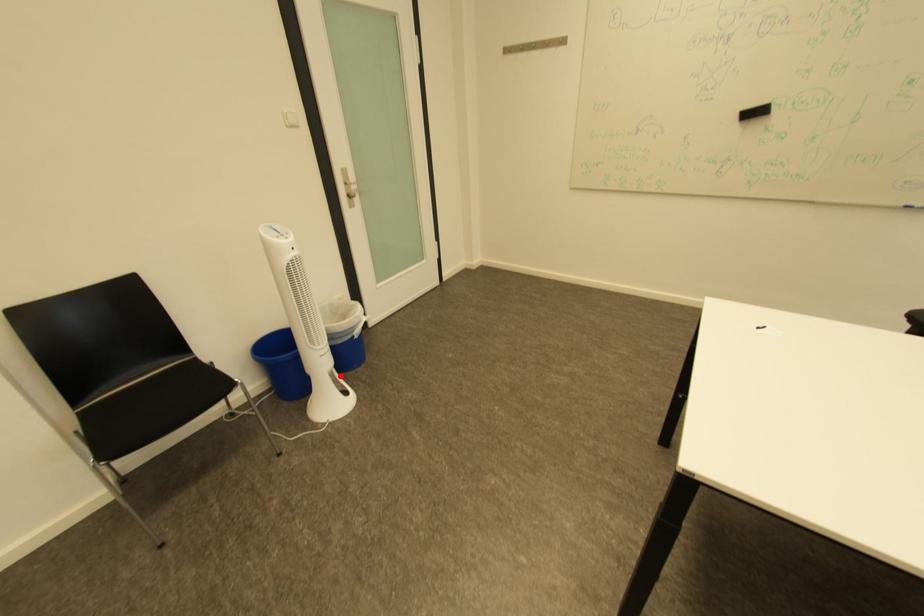
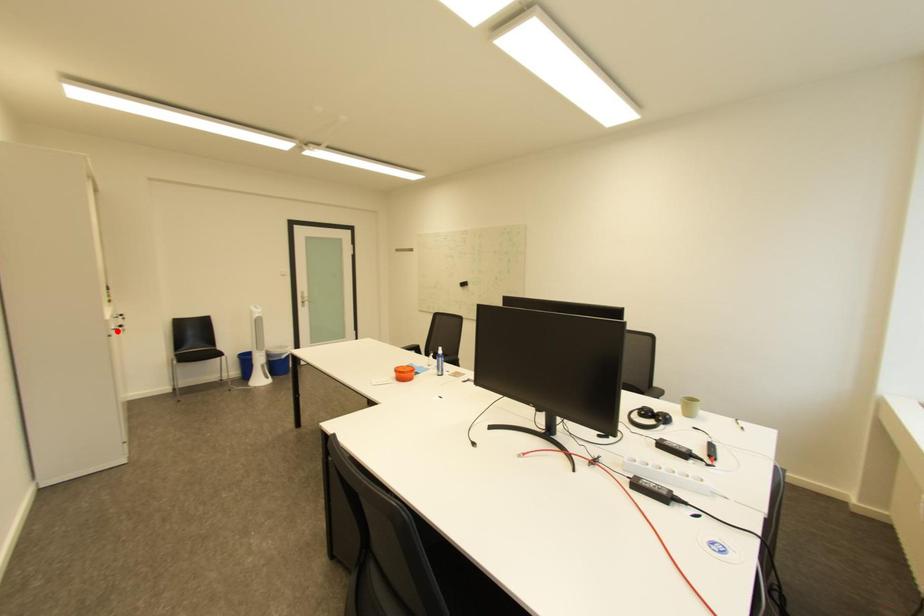
Looking at this image, I am providing you with two images of the same scene from different viewpoints. A red point is marked on the first image and another point is marked on the second image. Is the red point in image1 aligned with the point shown in image2?

No